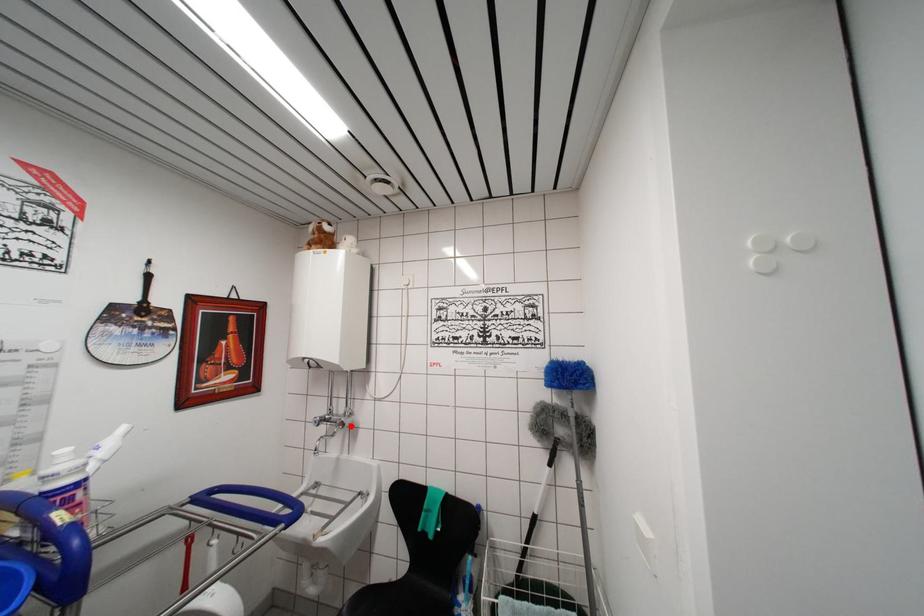
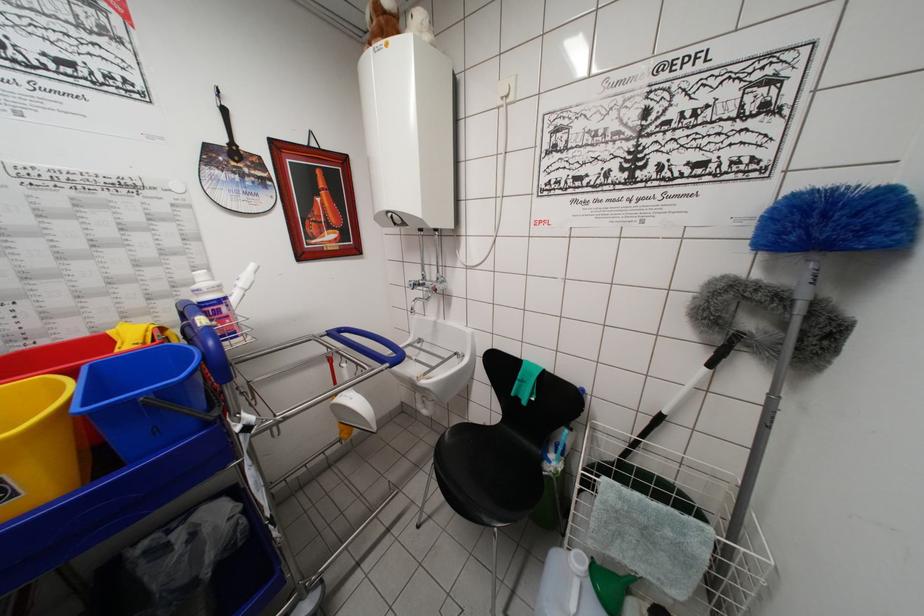
Question: I am providing you with two images of the same scene from different viewpoints. Given a red point in image1, look at the same physical point in image2. Is it:

Choices:
 (A) Closer to the viewpoint
 (B) Farther from the viewpoint

Answer: (A)